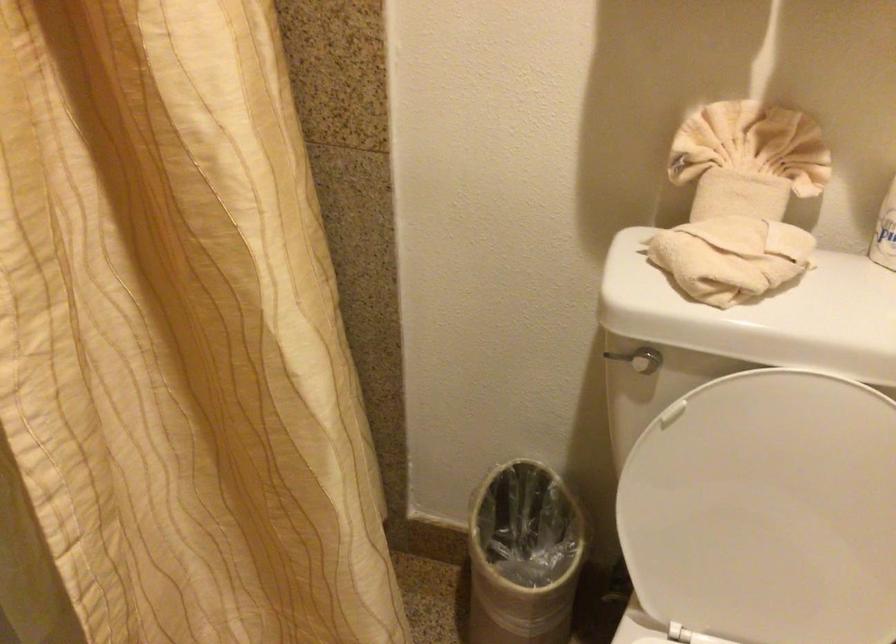
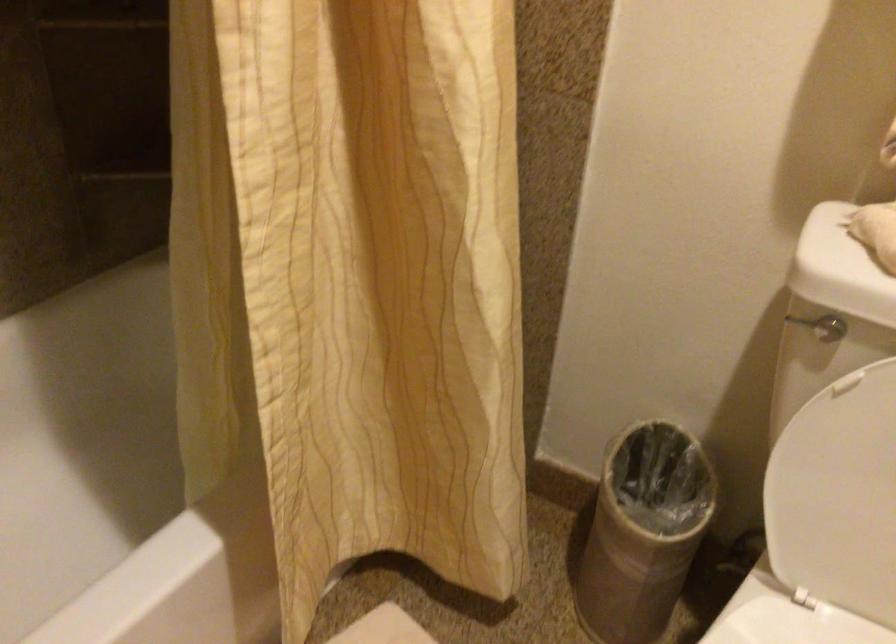
Question: The camera is either moving clockwise (left) or counter-clockwise (right) around the object. The first image is from the beginning of the video and the second image is from the end. Is the camera moving left or right when shooting the video?

Choices:
 (A) Left
 (B) Right

Answer: (B)